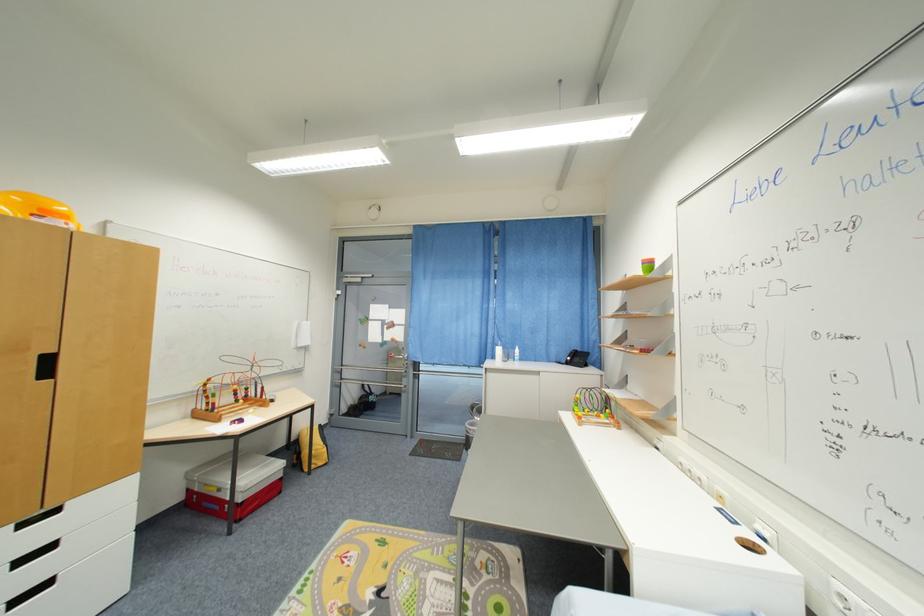
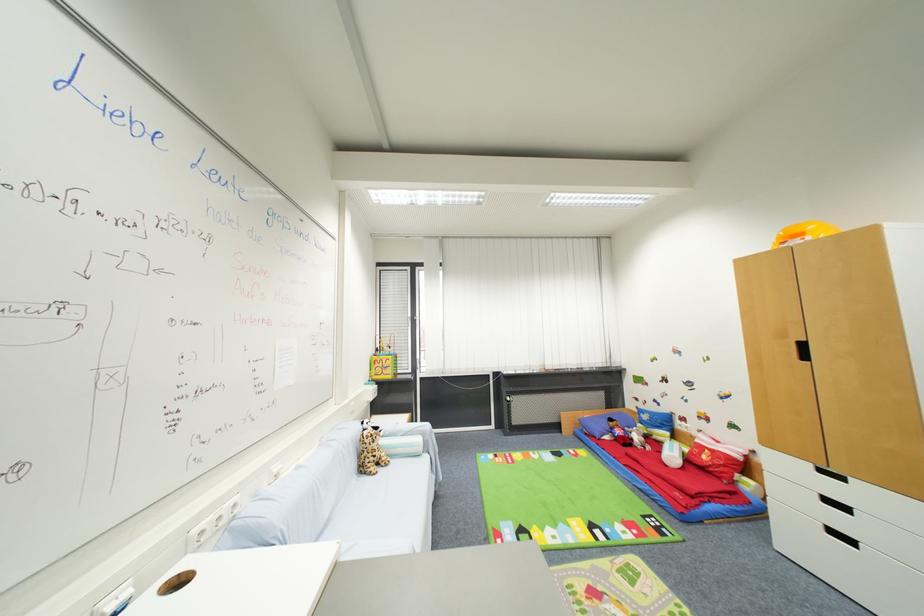
In the second image, find the point that corresponds to point (53, 586) in the first image.

(857, 544)